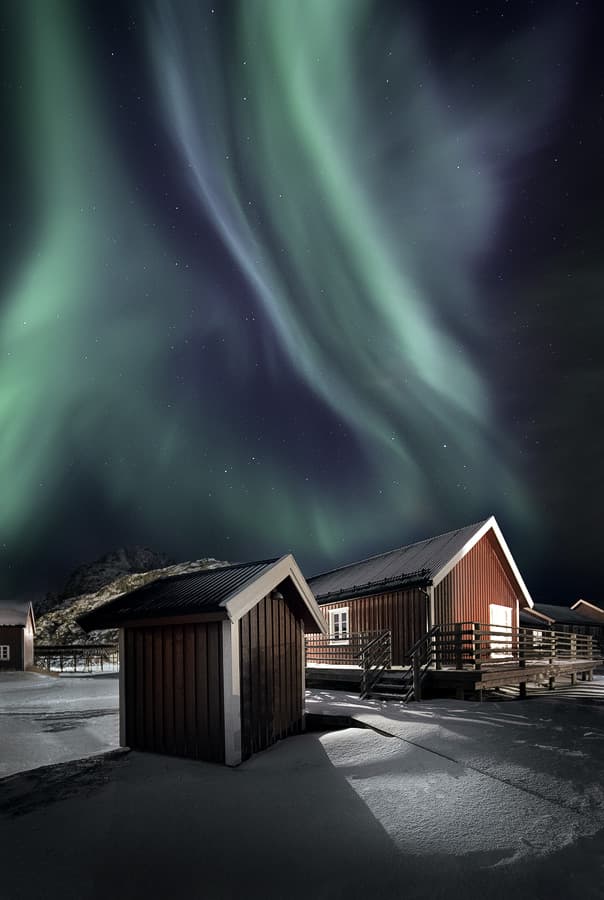
Where is `windows`? windows is located at coordinates (5, 651), (339, 626), (537, 634), (566, 626), (585, 628), (598, 632).